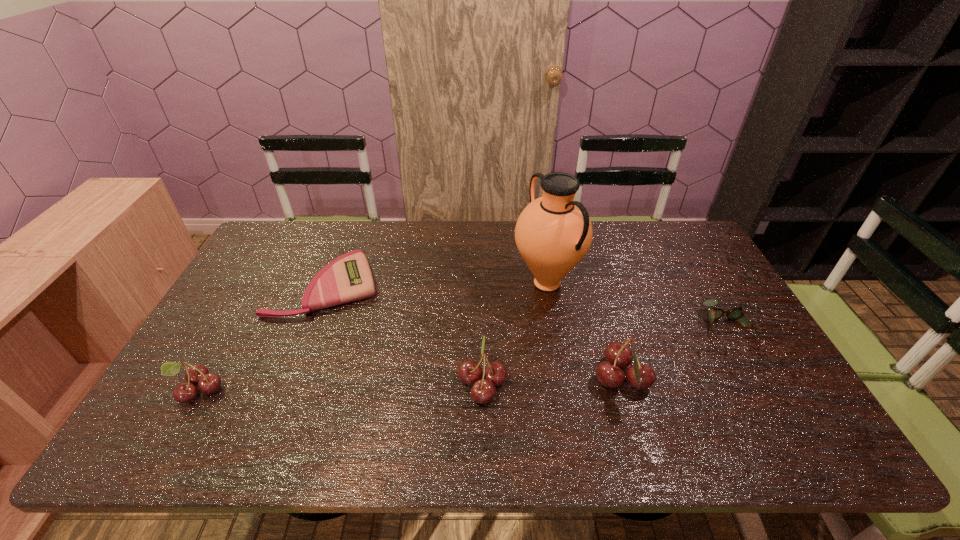
I want to click on the shortest cherry, so click(x=197, y=374).

Identify the location of the leftmost cherry. (197, 374).

Identify the location of the second cherry from left to right. (483, 391).

You are a GUI agent. You are given a task and a screenshot of the screen. Output one action in this format:
    pyautogui.click(x=<x>, y=<y>)
    Task: Click on the third object from left to right
    This screenshot has height=540, width=960.
    Given the screenshot: What is the action you would take?
    pyautogui.click(x=483, y=391)

Find the location of a particular element. the rightmost cherry is located at coordinates (609, 373).

The height and width of the screenshot is (540, 960). In order to click on wristlet in this screenshot , I will do `click(348, 278)`.

At what (x,y) coordinates should I click in order to perform the action: click on the rightmost object. Please return your answer as a coordinate pair (x, y). This screenshot has width=960, height=540. Looking at the image, I should click on (736, 313).

Find the location of `spectacles`. spectacles is located at coordinates (736, 313).

Locate an element on the screen. Image resolution: width=960 pixels, height=540 pixels. pitcher is located at coordinates (553, 233).

I want to click on free space located 0.250m on the leaves of the third tallest object, so click(358, 383).